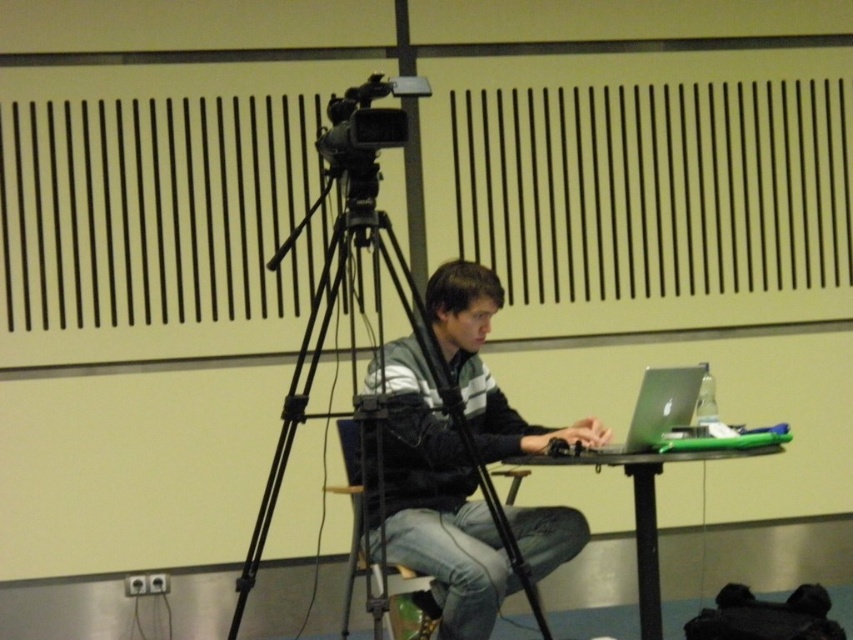
You are organizing a small event and need to place a 24 inch wide decorative item between the green plastic table at center and the denim at center. Will there be enough space?

The green plastic table at center and denim at center are 30.48 inches apart. Since the decorative item is 24 inches wide, there is enough space to place it between them as 24 inches is less than 30.48 inches.

You are organizing a conference and need to place a name tag on the table. The name tag is small and must be placed above the silver metallic laptop at center. Is there space available above the denim at center for the name tag?

The denim at center is located below the silver metallic laptop at center, so there is space above the denim at center for the name tag.